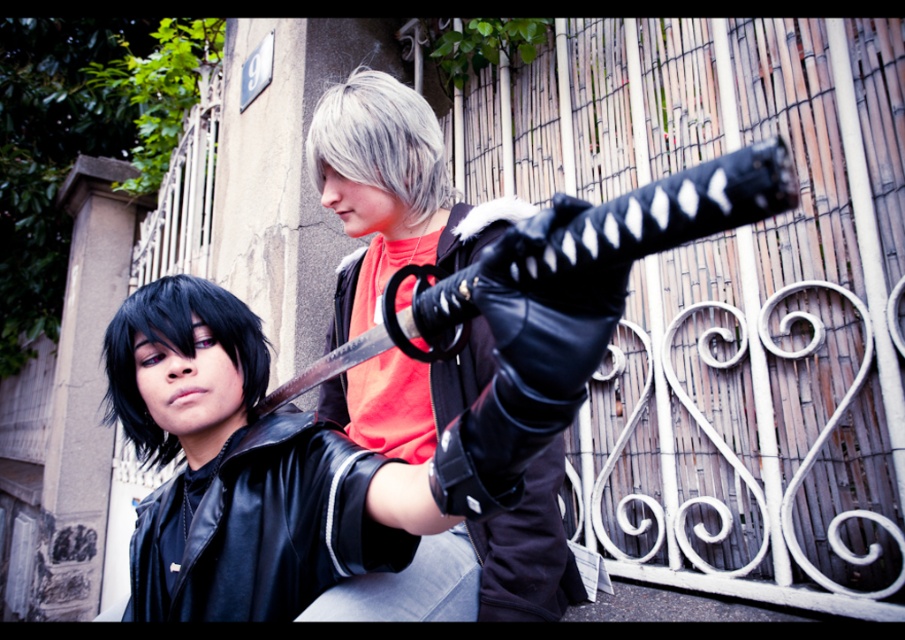
You are standing in front of the two people leaning against the stone wall. There are two points marked in the image. One is at coordinate point (362, 211) and the other is at point (164, 310). Which point is closer to you?

Point (164, 310) is closer to you because it is in front of point (362, 211).

You are an archer standing at the origin point in this image. You need to shoot an arrow to hit the black leather jacket at center. What are the coordinates you should aim for?

You should aim for the coordinates point at (265, 528) to hit the black leather jacket at center.

You are a game character standing at the bottom right corner of the frame. You need to pick up the black leather glove at center. Which direction should you move to reach it?

Since the black leather glove at center is located at point (389, 192), you should move towards the upper left direction to reach it.